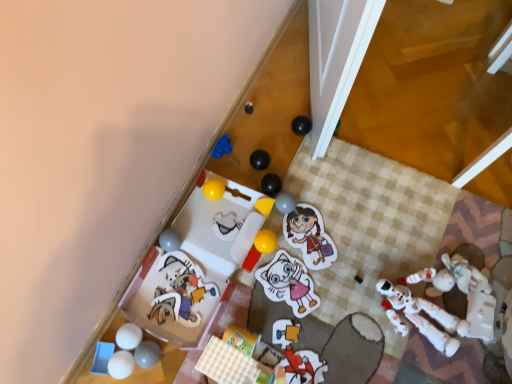
You are a GUI agent. You are given a task and a screenshot of the screen. Output one action in this format:
    pyautogui.click(x=<x>, y=<y>)
    Task: Click on the unoccupied space behind white matte cat at center, which is counted as the 2th toy, starting from the right
    This screenshot has height=384, width=512.
    Given the screenshot: What is the action you would take?
    pyautogui.click(x=297, y=234)